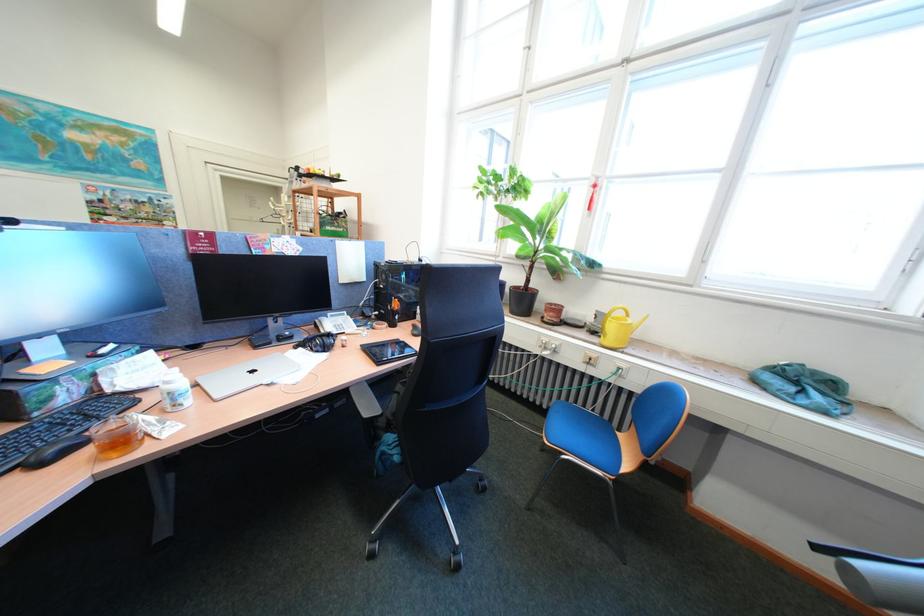
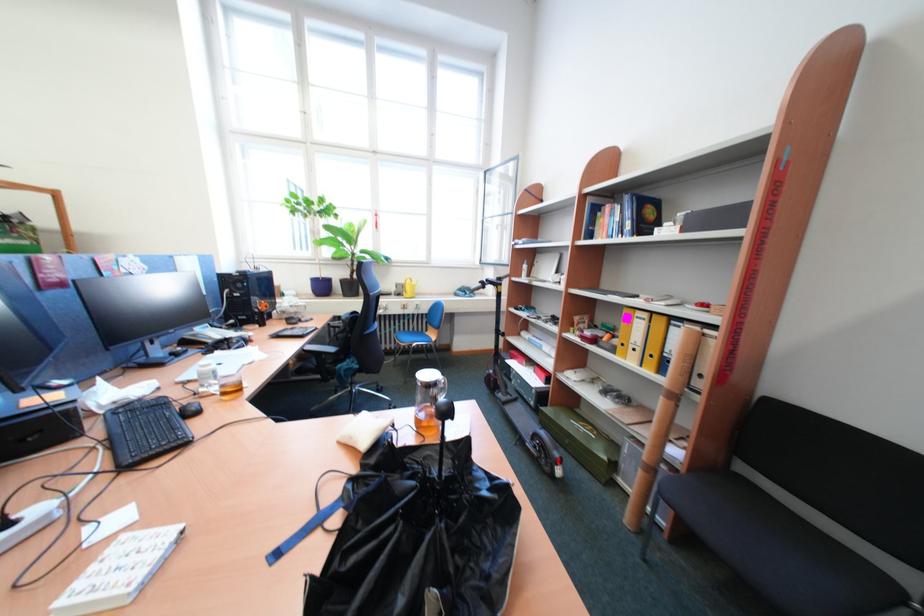
In the second image, find the point that corresponds to pixel 542 511 in the first image.

(419, 385)